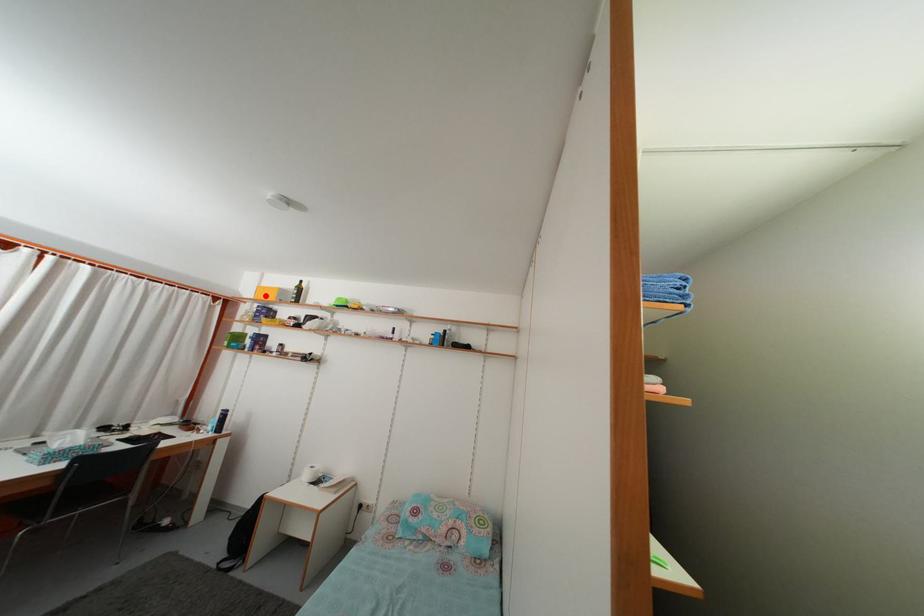
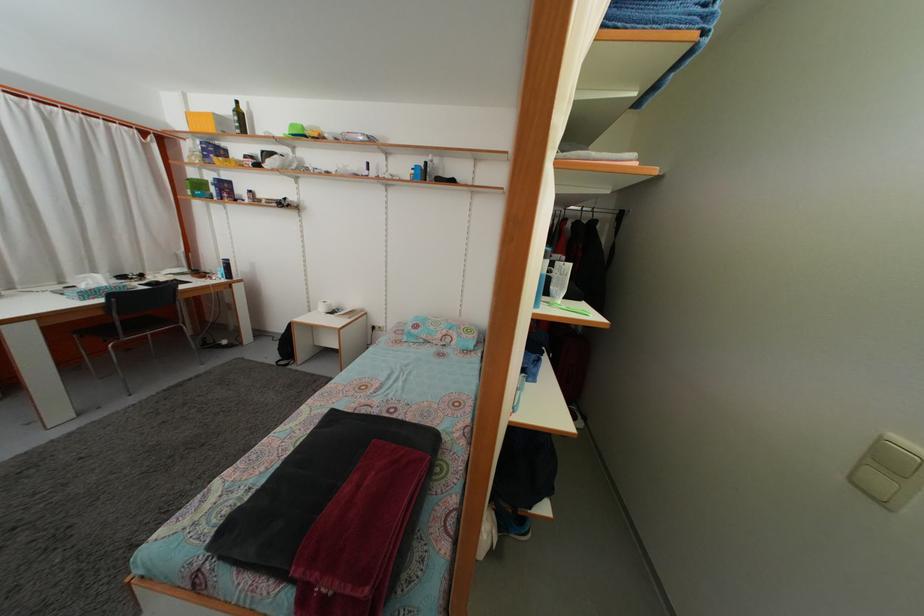
In the second image, find the point that corresponds to the highlighted location in the first image.

(196, 123)